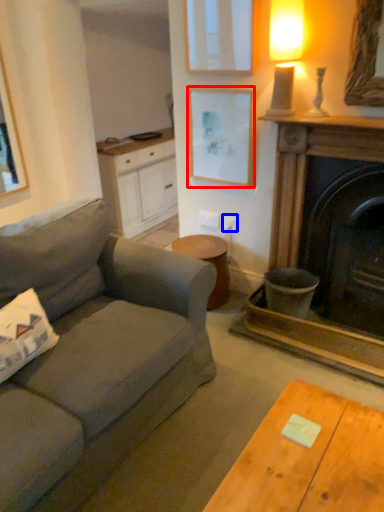
Question: Which of the following is the closest to the observer, picture frame (highlighted by a red box) or power outlet (highlighted by a blue box)?

Choices:
 (A) picture frame
 (B) power outlet

Answer: (A)